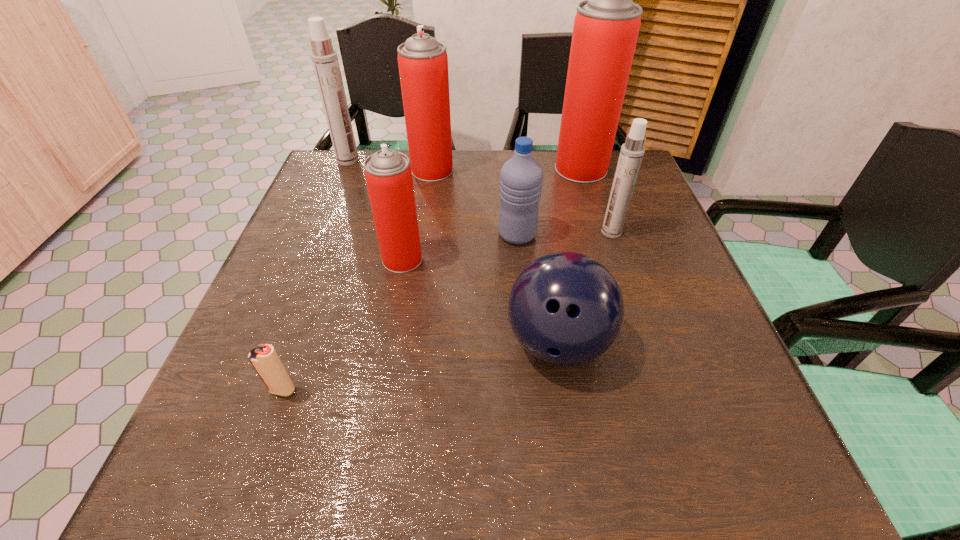
Find the location of a particular element. Image resolution: width=960 pixels, height=540 pixels. the closest aerosol can to the fourth farthest aerosol can is located at coordinates (606, 26).

Identify which aerosol can is located as the second nearest to the igniter. Please provide its 2D coordinates. Your answer should be formatted as a tuple, i.e. [(x, y)], where the tuple contains the x and y coordinates of a point satisfying the conditions above.

[(422, 60)]

Identify which red aerosol can is the third nearest to the blue bowling ball. Please provide its 2D coordinates. Your answer should be formatted as a tuple, i.e. [(x, y)], where the tuple contains the x and y coordinates of a point satisfying the conditions above.

[(422, 60)]

Choose which red aerosol can is the second nearest neighbor to the nearest aerosol can. Please provide its 2D coordinates. Your answer should be formatted as a tuple, i.e. [(x, y)], where the tuple contains the x and y coordinates of a point satisfying the conditions above.

[(606, 26)]

The width and height of the screenshot is (960, 540). In order to click on vacant region that satisfies the following two spatial constraints: 1. on the back side of the nearest aerosol can; 2. on the left side of the red igniter in this screenshot , I will do `click(329, 259)`.

Where is `blank space that satisfies the following two spatial constraints: 1. on the back side of the second biggest red aerosol can; 2. on the right side of the tallest object`? blank space that satisfies the following two spatial constraints: 1. on the back side of the second biggest red aerosol can; 2. on the right side of the tallest object is located at coordinates (433, 169).

The width and height of the screenshot is (960, 540). What are the coordinates of `vacant point that satisfies the following two spatial constraints: 1. on the front side of the left white aerosol can; 2. on the right side of the igniter` in the screenshot? It's located at (255, 390).